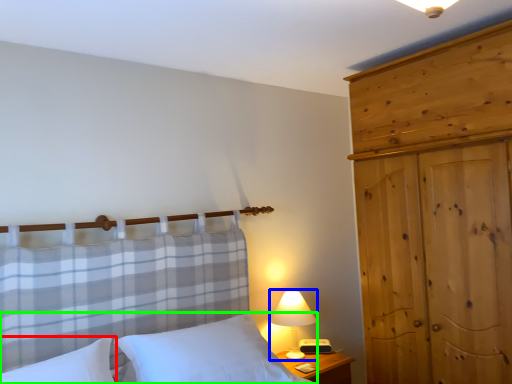
Question: Estimate the real-world distances between objects in this image. Which object is farther from pillow (highlighted by a red box), table lamp (highlighted by a blue box) or bed (highlighted by a green box)?

Choices:
 (A) table lamp
 (B) bed

Answer: (A)